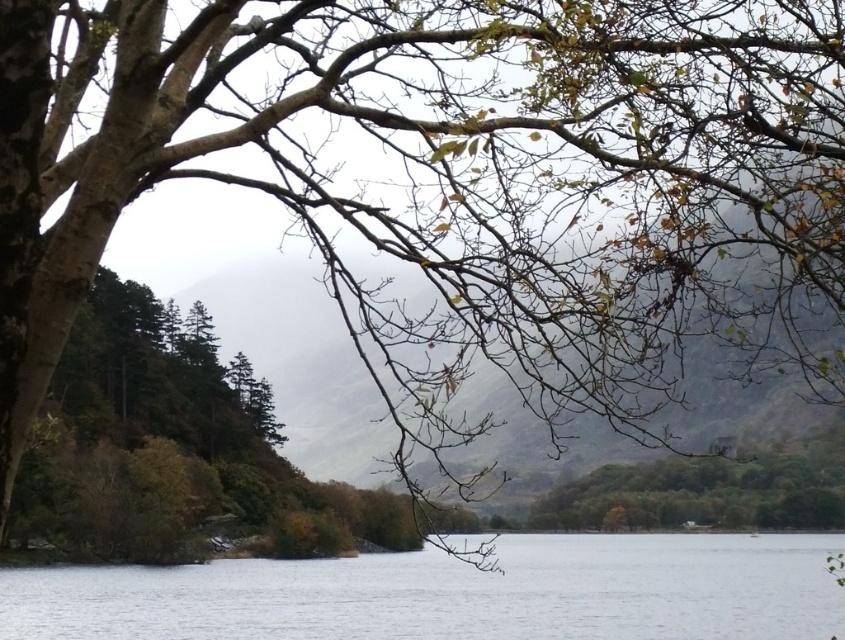
Can you confirm if transparent water at center is thinner than green matte tree at lower right?

Incorrect, transparent water at center's width is not less than green matte tree at lower right's.

Between point (420, 580) and point (838, 468), which one is positioned in front?

Point (838, 468)

In order to click on transparent water at center in this screenshot , I will do point(454,593).

Image resolution: width=845 pixels, height=640 pixels. I want to click on transparent water at center, so click(454, 593).